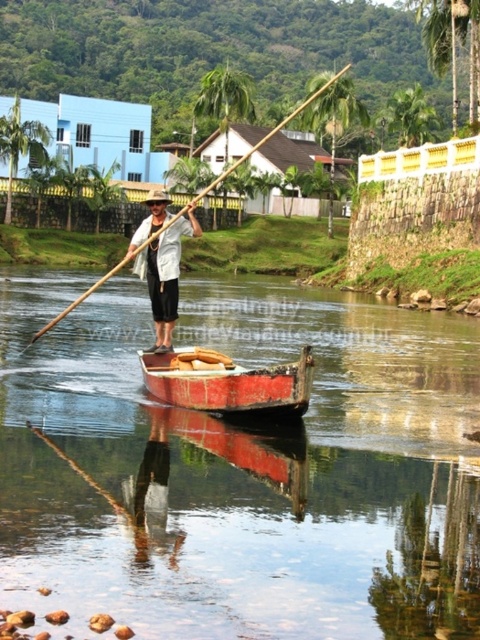
What is the 2D coordinate of the rusty wood canoe at center?

The rusty wood canoe at center is located at the 2D coordinate point of (227, 381).

You are standing at the camera position and want to throw a lifebuoy to the man in the white matte shirt at center. The lifebuoy can travel 50 meters. Will it reach him?

The distance between the white matte shirt at center and the camera is 48.09 meters. Since the lifebuoy can travel 50 meters, it will reach the man in the white matte shirt at center.

You are standing at the riverside and see a point marked at coordinates (227, 381). What object is located at that point?

The point at coordinates (227, 381) indicates the location of the rusty wood canoe at center.